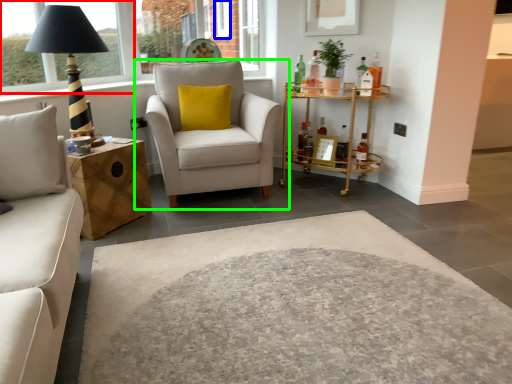
Question: Considering the real-world distances, which object is closest to window frame (highlighted by a red box)? window (highlighted by a blue box) or chair (highlighted by a green box).

Choices:
 (A) window
 (B) chair

Answer: (B)